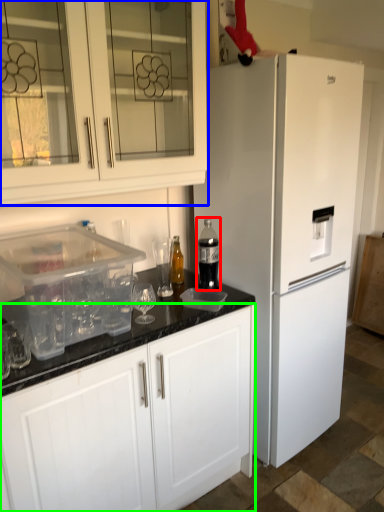
Question: Which is farther away from bottle (highlighted by a red box)? cabinetry (highlighted by a blue box) or cabinetry (highlighted by a green box)?

Choices:
 (A) cabinetry
 (B) cabinetry

Answer: (B)